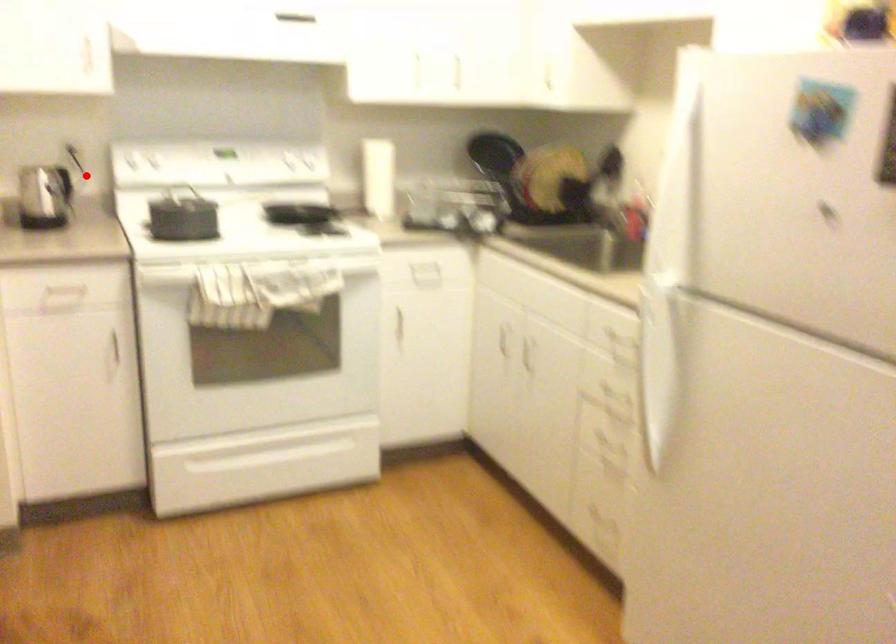
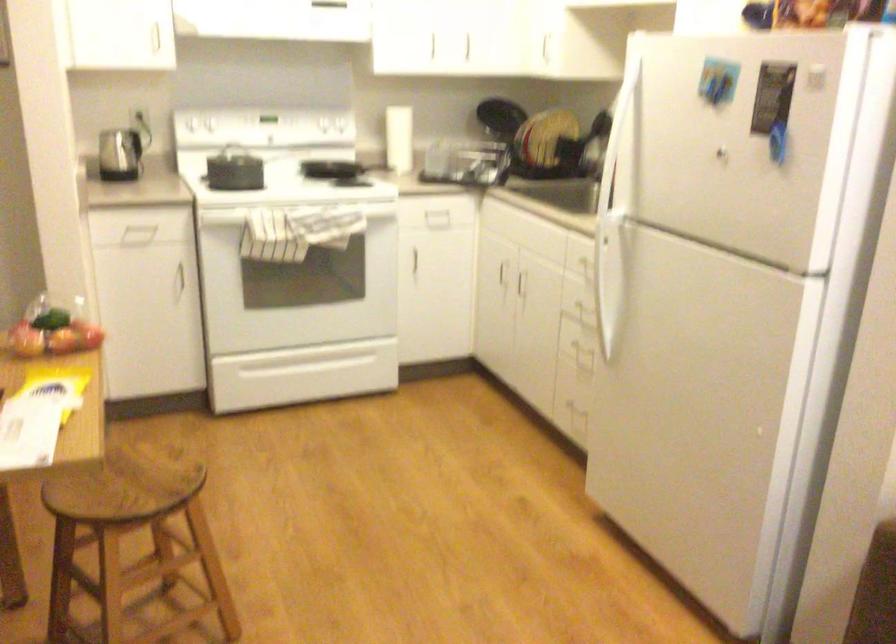
Where in the second image is the point corresponding to the highlighted location from the first image?

(149, 131)